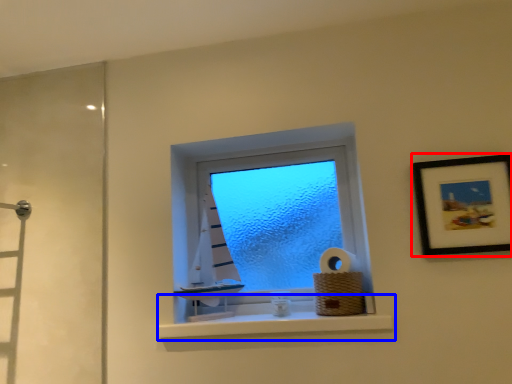
Question: Which of the following is the farthest to the observer, picture frame (highlighted by a red box) or window sill (highlighted by a blue box)?

Choices:
 (A) picture frame
 (B) window sill

Answer: (B)